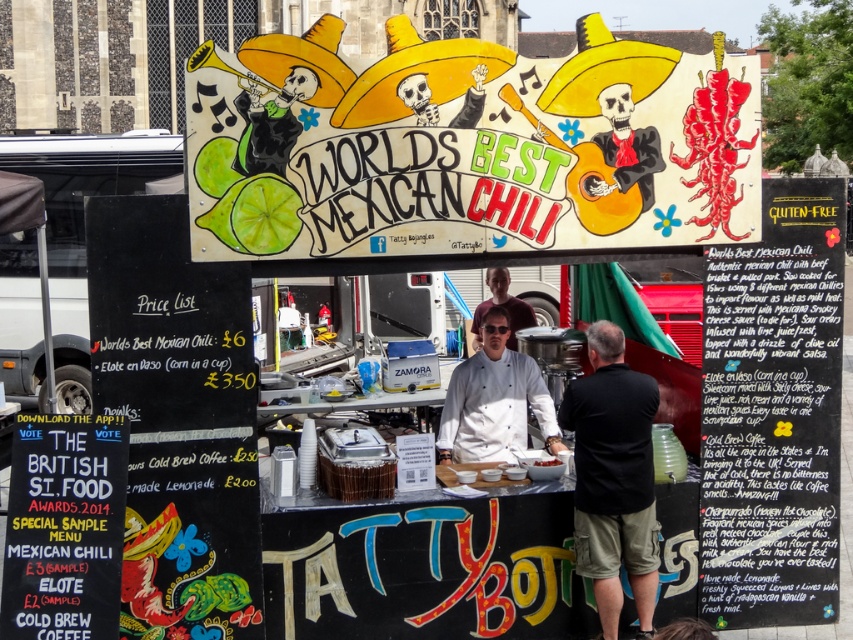
Where is `black cotton shirt at center`? black cotton shirt at center is located at coordinates (613, 477).

Is point (628, 403) positioned after point (480, 376)?

No, (628, 403) is in front of (480, 376).

Does point (596, 595) come in front of point (476, 445)?

Yes, point (596, 595) is in front of point (476, 445).

Where is `black cotton shirt at center`? black cotton shirt at center is located at coordinates 613,477.

Is point (439, 445) farther from viewer compared to point (515, 321)?

That is False.

Who is positioned more to the left, white chef coat at center or matte white chef coat at center?

From the viewer's perspective, white chef coat at center appears more on the left side.

Who is more distant from viewer, (467, 433) or (508, 276)?

Point (508, 276)

In order to click on white chef coat at center in this screenshot , I will do `click(494, 401)`.

Between glittery blackboard at right and white chef coat at center, which one has less height?

With less height is white chef coat at center.

What do you see at coordinates (773, 413) in the screenshot?
I see `glittery blackboard at right` at bounding box center [773, 413].

Who is more distant from viewer, (728,456) or (544,445)?

The point (544,445) is more distant.

Where is `glittery blackboard at right`? This screenshot has height=640, width=853. glittery blackboard at right is located at coordinates (773, 413).